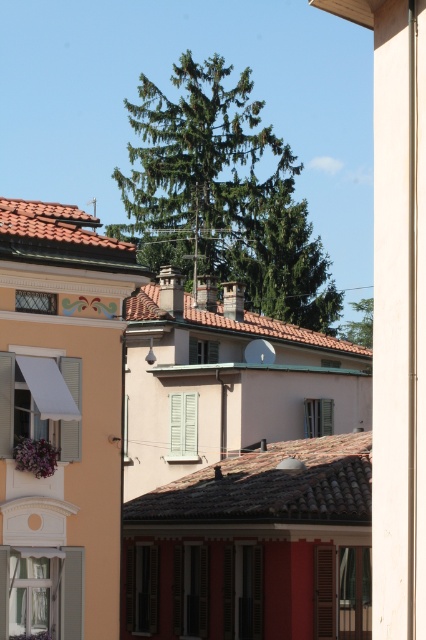
Question: Which object appears closest to the camera in this image?

Choices:
 (A) green needle-like tree at upper center
 (B) green leafy tree at upper center

Answer: (A)

Question: Does green needle-like tree at upper center have a greater width compared to green leafy tree at upper center?

Choices:
 (A) yes
 (B) no

Answer: (A)

Question: Is green needle-like tree at upper center below green leafy tree at upper center?

Choices:
 (A) yes
 (B) no

Answer: (B)

Question: Which point is closer to the camera taking this photo?

Choices:
 (A) (342, 337)
 (B) (157, 211)

Answer: (B)

Question: Is green needle-like tree at upper center smaller than green leafy tree at upper center?

Choices:
 (A) yes
 (B) no

Answer: (B)